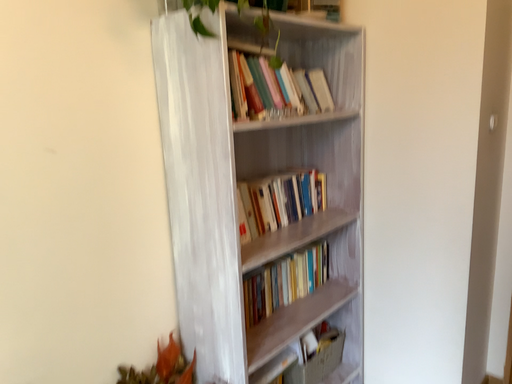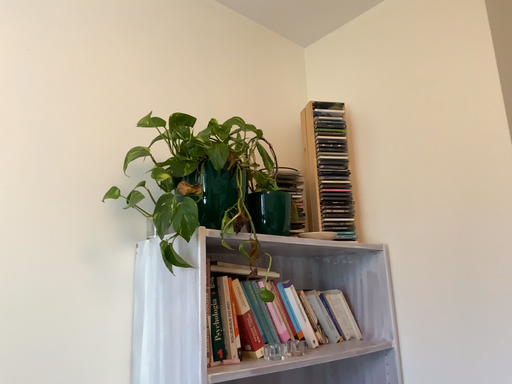
Question: Which way did the camera rotate in the video?

Choices:
 (A) rotated right
 (B) rotated left

Answer: (B)